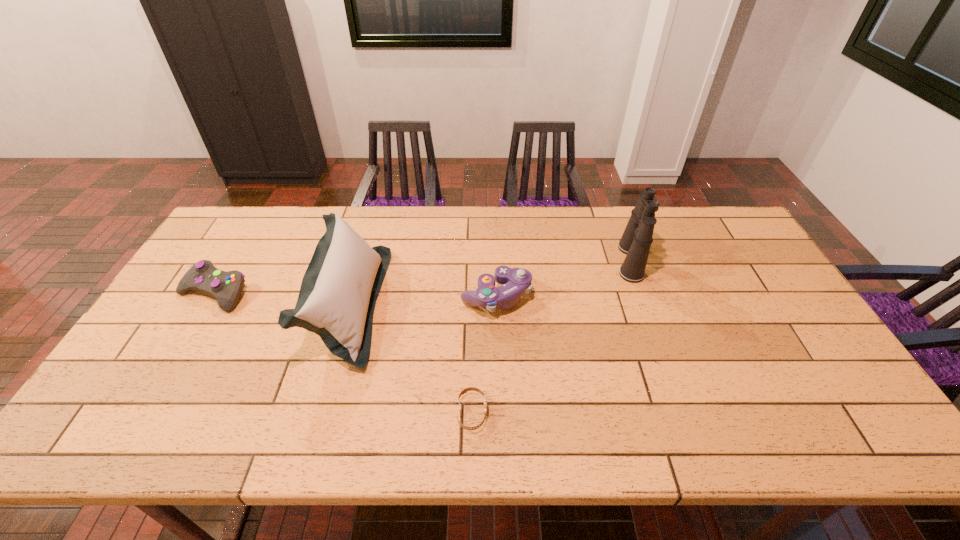
Choose which object is the third nearest neighbor to the shortest object. Please provide its 2D coordinates. Your answer should be formatted as a tuple, i.e. [(x, y)], where the tuple contains the x and y coordinates of a point satisfying the conditions above.

[(636, 240)]

At what (x,y) coordinates should I click in order to perform the action: click on object that is the second nearest to the cushion. Please return your answer as a coordinate pair (x, y). This screenshot has width=960, height=540. Looking at the image, I should click on 515,281.